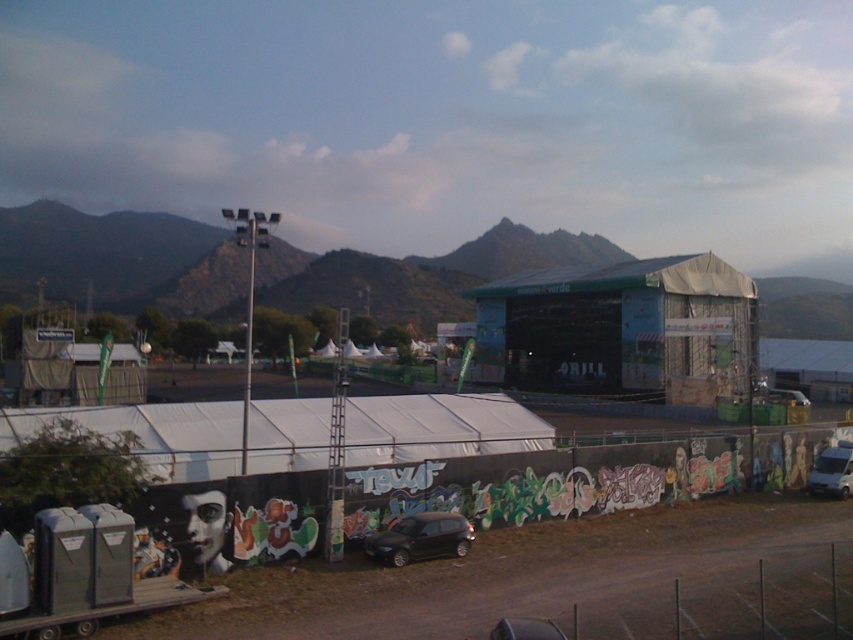
Question: Considering the real-world distances, which object is farthest from the satin black car at lower center?

Choices:
 (A) white matte van at center
 (B) white matte van at lower right
 (C) black graffiti wall at lower center
 (D) metallic wire fence at lower right

Answer: (A)

Question: Is black graffiti wall at lower center smaller than white matte van at center?

Choices:
 (A) no
 (B) yes

Answer: (A)

Question: In this image, where is black graffiti wall at lower center located relative to white matte van at center?

Choices:
 (A) below
 (B) above

Answer: (B)

Question: Does black graffiti wall at lower center have a smaller size compared to white matte van at center?

Choices:
 (A) yes
 (B) no

Answer: (B)

Question: Which of the following is the farthest from the observer?

Choices:
 (A) (810, 492)
 (B) (805, 595)
 (C) (450, 541)
 (D) (805, 403)

Answer: (D)

Question: Based on their relative distances, which object is nearer to the white matte van at lower right?

Choices:
 (A) white matte van at center
 (B) satin black car at lower center

Answer: (B)